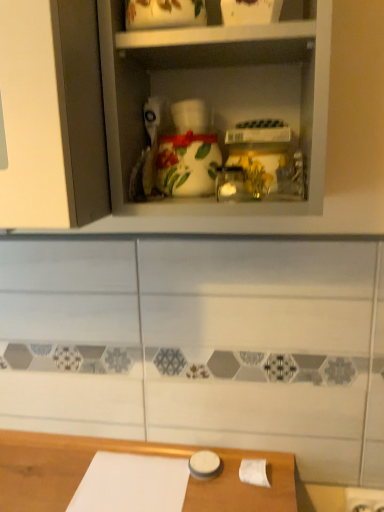
Question: Does white paper at lower right have a lesser height compared to white glossy vase at center?

Choices:
 (A) no
 (B) yes

Answer: (B)

Question: Would you consider white paper at lower right to be distant from white glossy vase at center?

Choices:
 (A) yes
 (B) no

Answer: (B)

Question: From a real-world perspective, is white paper at lower right on white glossy vase at center?

Choices:
 (A) no
 (B) yes

Answer: (A)

Question: Is white paper at lower right facing towards white glossy vase at center?

Choices:
 (A) yes
 (B) no

Answer: (B)

Question: Can you confirm if white paper at lower right is positioned to the left of white glossy vase at center?

Choices:
 (A) no
 (B) yes

Answer: (A)

Question: Can you confirm if white paper at lower right is positioned to the right of white glossy vase at center?

Choices:
 (A) no
 (B) yes

Answer: (B)

Question: Is white glossy vase at center surrounding white paper at lower right?

Choices:
 (A) no
 (B) yes

Answer: (A)

Question: From a real-world perspective, is white glossy vase at center located beneath white paper at lower right?

Choices:
 (A) no
 (B) yes

Answer: (A)

Question: Is white glossy vase at center far away from white paper at lower right?

Choices:
 (A) no
 (B) yes

Answer: (A)

Question: Is white glossy vase at center taller than white paper at lower right?

Choices:
 (A) yes
 (B) no

Answer: (A)

Question: Considering the relative sizes of white glossy vase at center and white paper at lower right in the image provided, is white glossy vase at center smaller than white paper at lower right?

Choices:
 (A) no
 (B) yes

Answer: (A)

Question: Is white paper at lower right at the back of white glossy vase at center?

Choices:
 (A) no
 (B) yes

Answer: (A)

Question: From the image's perspective, is white paper at lower right positioned above or below white glossy vase at center?

Choices:
 (A) below
 (B) above

Answer: (A)